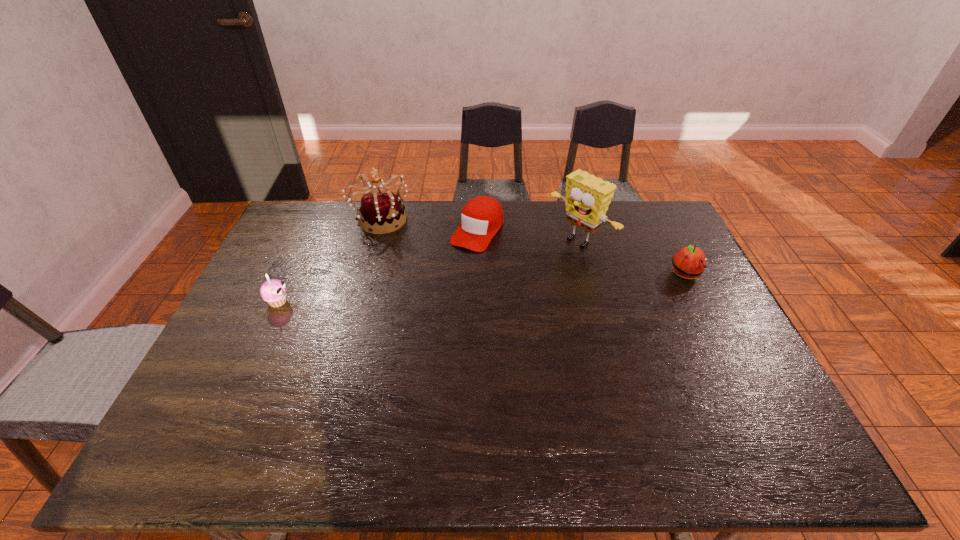
Find the location of a particular element. The image size is (960, 540). vacant space situated on the front-facing side of the sponge is located at coordinates (486, 308).

I want to click on vacant position located on the front-facing side of the sponge, so click(x=475, y=315).

At what (x,y) coordinates should I click in order to perform the action: click on vacant point located on the front-facing side of the third object from left to right. Please return your answer as a coordinate pair (x, y). The width and height of the screenshot is (960, 540). Looking at the image, I should click on (433, 295).

You are a GUI agent. You are given a task and a screenshot of the screen. Output one action in this format:
    pyautogui.click(x=<x>, y=<y>)
    Task: Click on the free space located on the front-facing side of the third object from left to right
    
    Given the screenshot: What is the action you would take?
    pyautogui.click(x=441, y=285)

Identify the location of vacant space positioned 0.350m on the front-facing side of the third object from left to right. (412, 323).

Where is `vacant region located on the front-facing side of the second object from left to right`? vacant region located on the front-facing side of the second object from left to right is located at coordinates (420, 249).

This screenshot has height=540, width=960. I want to click on free space located 0.230m on the front-facing side of the second object from left to right, so click(440, 264).

Where is `free space located on the front-facing side of the second object from left to right`? This screenshot has height=540, width=960. free space located on the front-facing side of the second object from left to right is located at coordinates pos(436,261).

Image resolution: width=960 pixels, height=540 pixels. Find the location of `sponge that is at the far edge`. sponge that is at the far edge is located at coordinates (587, 199).

I want to click on baseball cap located in the far edge section of the desktop, so click(x=482, y=217).